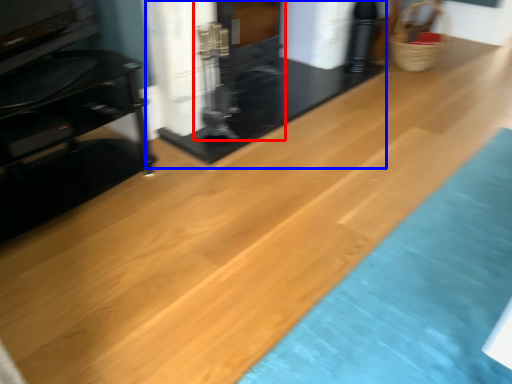
Question: Among these objects, which one is farthest to the camera, fireplace (highlighted by a red box) or fireplace (highlighted by a blue box)?

Choices:
 (A) fireplace
 (B) fireplace

Answer: (A)